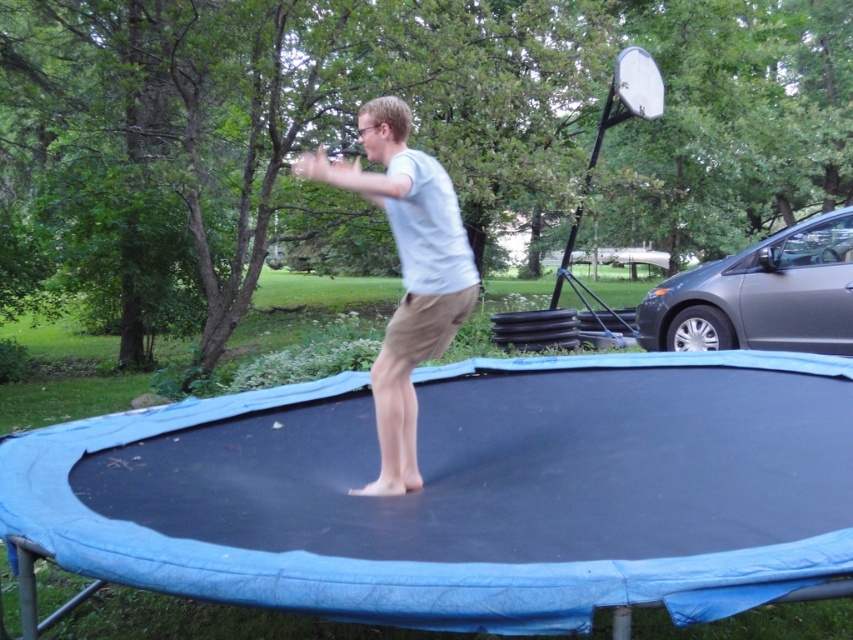
You are a photographer trying to capture a photo of the white matte shirt at center and the gray metallic car at right. If you want both objects to appear equally sized in the final image, what should you do?

Since the white matte shirt at center is smaller than the gray metallic car at right, you should move closer to the white matte shirt at center and farther from the gray metallic car at right to make them appear the same size in the photo.

You are a delivery robot that needs to deliver a package to the gray metallic car at right. You are currently at the white matte shirt at center. Can you drive directly to the car without moving around any obstacles?

The distance between white matte shirt at center and gray metallic car at right is 5.24 meters. Since there are no obstacles mentioned in the scene description, the robot can drive directly to the car.

You are a photographer positioned to the left of the scene. You need to capture a photo of the white matte shirt at center and the gray metallic car at right. Which object should you move towards to get both in frame?

You should move towards the gray metallic car at right because the white matte shirt at center is to the left of the gray metallic car at right, so moving towards the car will keep both objects within your field of view.